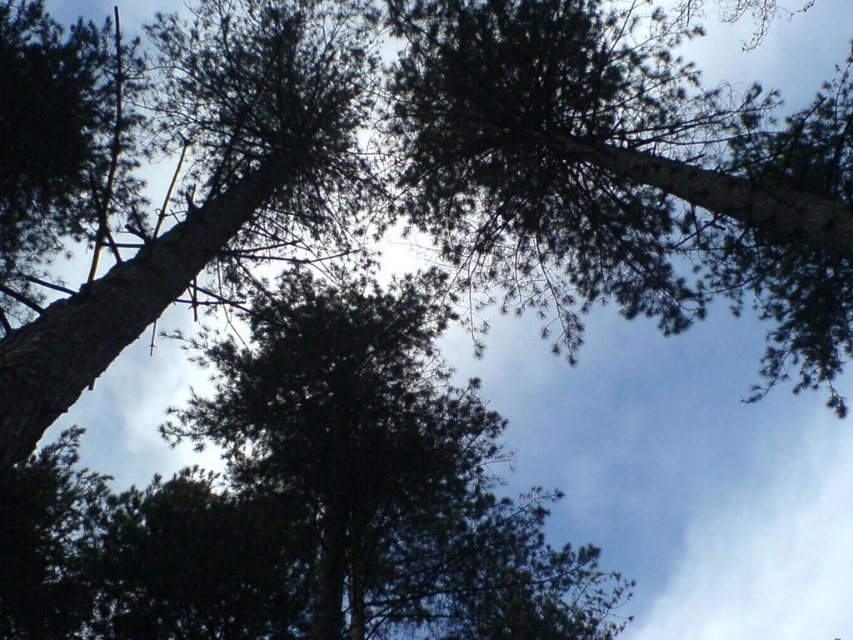
You are standing directly below the dark green textured tree at center. If you look straight ahead, what direction would the tree be in relative to your position?

The dark green textured tree at center is directly above you since you are standing directly below it.

From the picture: You are standing under the dense canopy of tall pine trees and notice a specific point marked at coordinates point (631, 170). Based on the scene, where is this point located?

The point (631, 170) is on the green needle like foliage at upper center.